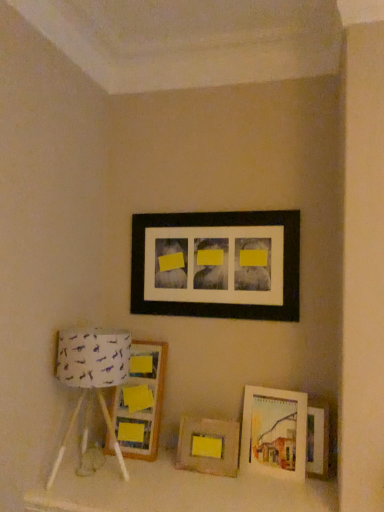
Question: Looking at the image, does wooden frame at center, which appears as the 1th picture frame when ordered from the bottom, seem bigger or smaller compared to wooden picture frame at left, which is the second picture frame in top-to-bottom order?

Choices:
 (A) small
 (B) big

Answer: (A)

Question: From a real-world perspective, relative to wooden picture frame at left, which is the second picture frame in top-to-bottom order, is wooden frame at center, arranged as the 5th picture frame when viewed from the top, vertically above or below?

Choices:
 (A) above
 (B) below

Answer: (B)

Question: Which object is the closest to the wooden picture frame at left, which is the second picture frame in top-to-bottom order?

Choices:
 (A) black matte picture frame at upper center, arranged as the fifth picture frame when ordered from the bottom
 (B) white fabric lampshade at left
 (C) matte wooden picture frame at lower right, which appears as the 3th picture frame when viewed from the top
 (D) wooden picture frame at lower right, the second picture frame positioned from the bottom
 (E) wooden frame at center, arranged as the 5th picture frame when viewed from the top

Answer: (E)

Question: Considering the real-world distances, which object is closest to the white fabric lampshade at left?

Choices:
 (A) wooden picture frame at left, which appears as the 4th picture frame when ordered from the bottom
 (B) wooden frame at center, arranged as the 5th picture frame when viewed from the top
 (C) black matte picture frame at upper center, the first picture frame in the top-to-bottom sequence
 (D) wooden picture frame at lower right, which ranks as the fourth picture frame in top-to-bottom order
 (E) matte wooden picture frame at lower right, acting as the third picture frame starting from the bottom

Answer: (A)